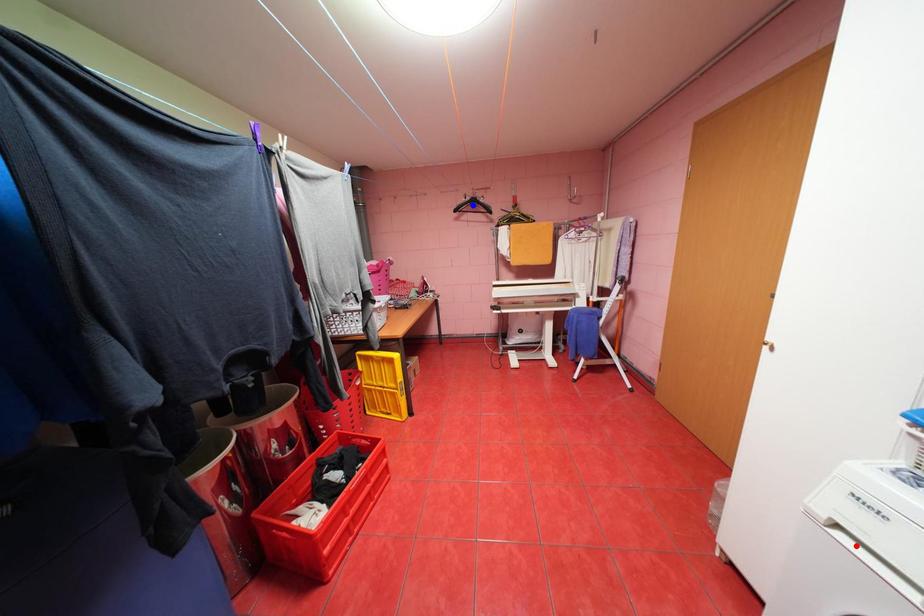
Question: Two points are marked on the image. Which point is closer to the camera?

Choices:
 (A) Blue point is closer.
 (B) Red point is closer.

Answer: (B)